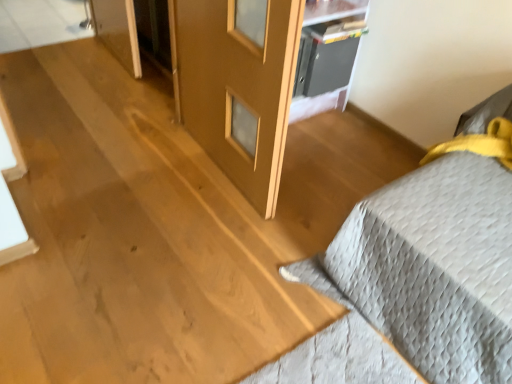
Where is `vacant region to the right of matte wood screen door at center`? vacant region to the right of matte wood screen door at center is located at coordinates (322, 190).